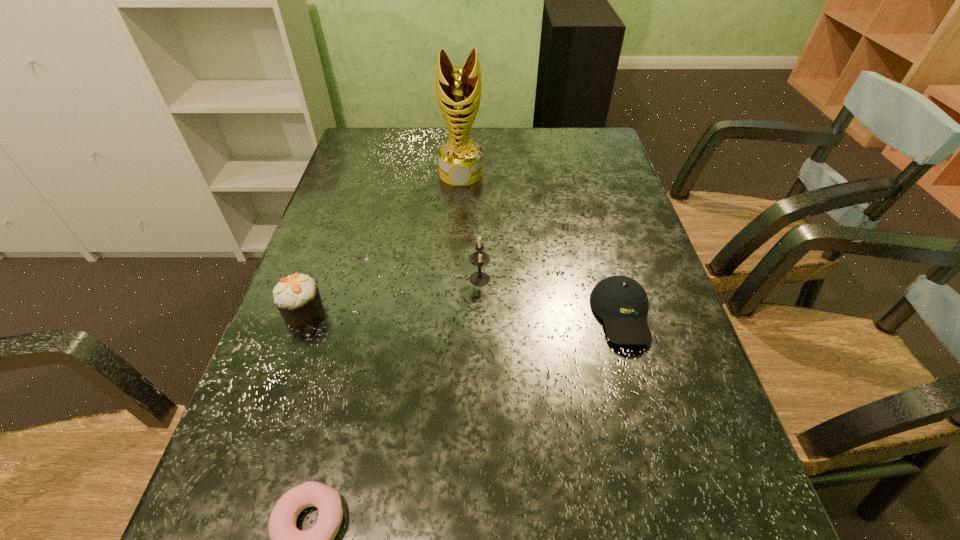
Identify the location of vacant area situated on the front-facing side of the baseball cap. (653, 423).

The width and height of the screenshot is (960, 540). In order to click on object located at the far edge in this screenshot , I will do `click(458, 89)`.

Locate an element on the screen. The height and width of the screenshot is (540, 960). object at the left edge is located at coordinates (297, 297).

Find the location of `object situated at the right edge`. object situated at the right edge is located at coordinates (621, 302).

The width and height of the screenshot is (960, 540). I want to click on vacant space at the far edge of the desktop, so click(538, 147).

In order to click on free spot at the left edge of the desktop in this screenshot , I will do `click(240, 470)`.

At what (x,y) coordinates should I click in order to perform the action: click on vacant space at the right edge. Please return your answer as a coordinate pair (x, y). This screenshot has width=960, height=540. Looking at the image, I should click on (684, 349).

Locate an element on the screen. free region at the far left corner is located at coordinates (374, 157).

Where is `vacant space at the far right corner of the desktop`? This screenshot has height=540, width=960. vacant space at the far right corner of the desktop is located at coordinates (613, 156).

Identify the location of free spot between the second tallest object and the award. pyautogui.click(x=470, y=226).